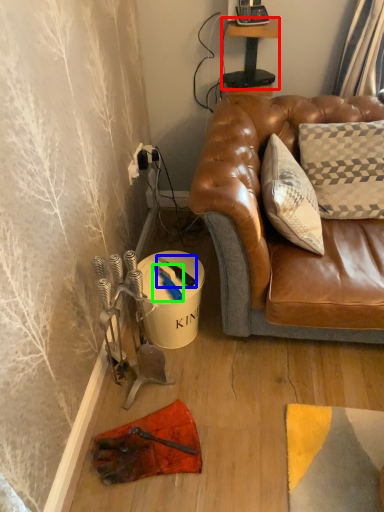
Question: Which object is the farthest from table (highlighted by a red box)? Choose among these: tool (highlighted by a blue box) or tool (highlighted by a green box).

Choices:
 (A) tool
 (B) tool

Answer: (B)